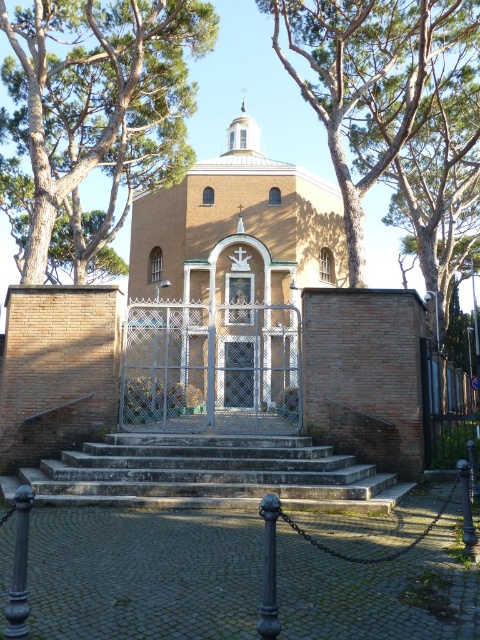
You are standing in front of the brown brick church at center and want to enter through the stone steps at center. Which direction should you move to reach the steps?

Since the brown brick church at center is to the left of the stone steps at center, you should move to your right to reach the steps.

You are a visitor approaching the closed metal gate in front of the historic brick church. You notice the brown textured tree at upper center and the stone steps at center. Which object is positioned to the right of the other?

The brown textured tree at upper center is to the right of the stone steps at center.